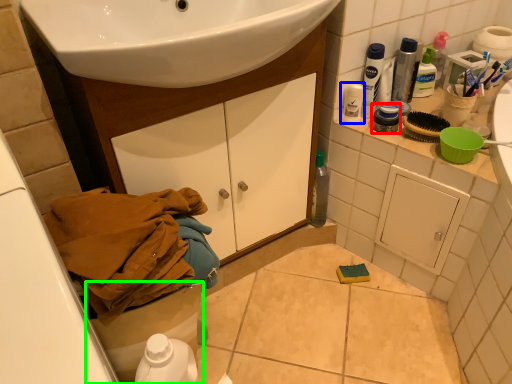
Question: Which is farther away from mouthwash (highlighted by a red box)? toiletry (highlighted by a blue box) or toilet bowl (highlighted by a green box)?

Choices:
 (A) toiletry
 (B) toilet bowl

Answer: (B)